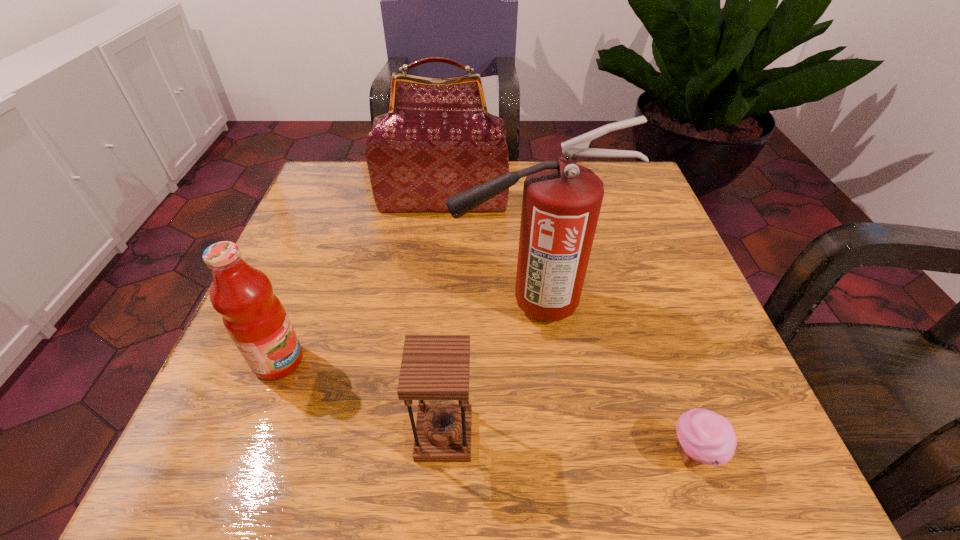
What are the coordinates of `fire extinguisher` in the screenshot? It's located at (561, 204).

The height and width of the screenshot is (540, 960). I want to click on the farthest object, so click(438, 140).

Find the location of `the leftmost object`. the leftmost object is located at coordinates (254, 317).

Image resolution: width=960 pixels, height=540 pixels. Find the location of `the third tallest object`. the third tallest object is located at coordinates (254, 317).

Locate an element on the screen. The width and height of the screenshot is (960, 540). the fourth tallest object is located at coordinates (434, 369).

Image resolution: width=960 pixels, height=540 pixels. Identify the location of the rightmost object. (703, 437).

Find the location of a particular element. This screenshot has width=960, height=540. the shortest object is located at coordinates (703, 437).

The width and height of the screenshot is (960, 540). I want to click on vacant area situated at the nozzle of the second farthest object, so click(293, 305).

The height and width of the screenshot is (540, 960). In order to click on free location located 0.120m at the nozzle of the second farthest object in this screenshot , I will do `click(389, 305)`.

Find the location of a particular element. The height and width of the screenshot is (540, 960). blank space located 0.170m at the nozzle of the second farthest object is located at coordinates (362, 305).